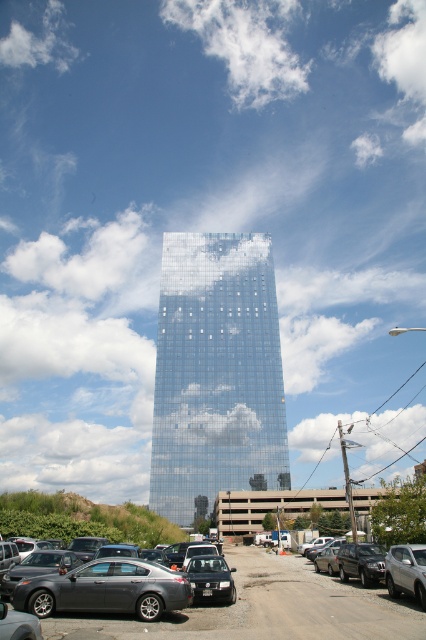
Question: Which point appears closest to the camera in this image?

Choices:
 (A) (321, 625)
 (B) (154, 609)
 (C) (213, 28)

Answer: (A)

Question: Where is white fluffy cloud at upper center located in relation to matte black suv at center in the image?

Choices:
 (A) right
 (B) left

Answer: (A)

Question: Does transparent glass building at center appear over matte gray sedan at lower center?

Choices:
 (A) yes
 (B) no

Answer: (A)

Question: Is transparent glass building at center further to the viewer compared to gray matte car at lower left?

Choices:
 (A) yes
 (B) no

Answer: (A)

Question: Which of the following is the closest to the observer?

Choices:
 (A) (227, 337)
 (B) (213, 560)
 (C) (281, 24)
 (D) (362, 612)

Answer: (D)

Question: Which of the following is the farthest from the observer?

Choices:
 (A) white fluffy cloud at upper center
 (B) white fluffy cloud at upper left

Answer: (B)